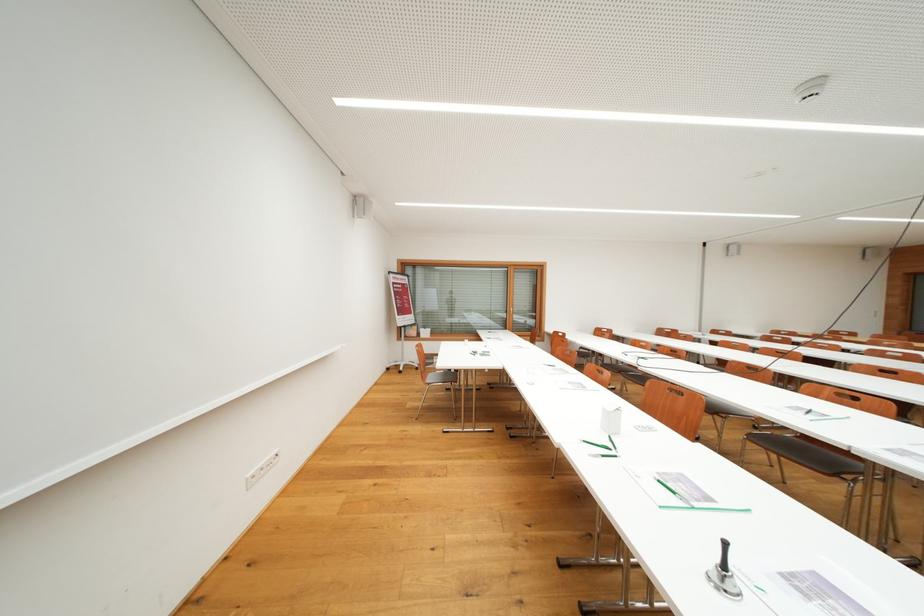
Find the location of a particular element. white power socket is located at coordinates (261, 469).